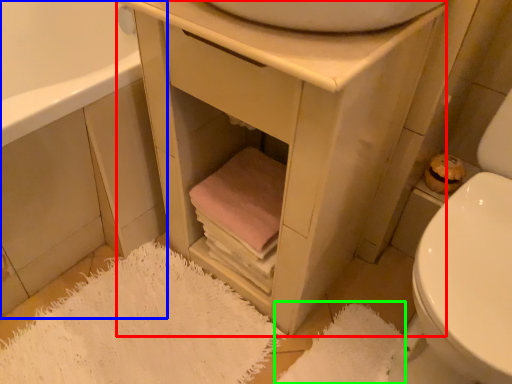
Question: Which object is the farthest from vanity (highlighted by a red box)? Choose among these: cabinetry (highlighted by a blue box) or bath mat (highlighted by a green box).

Choices:
 (A) cabinetry
 (B) bath mat

Answer: (B)